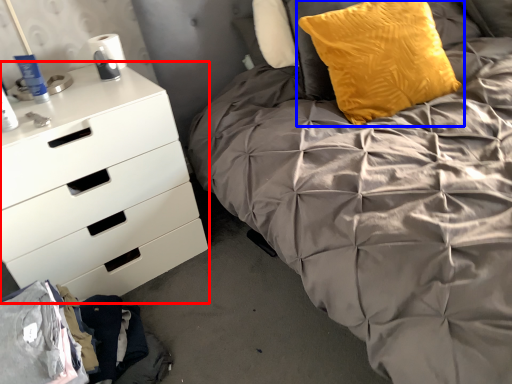
Question: Among these objects, which one is farthest to the camera, chest of drawers (highlighted by a red box) or pillow (highlighted by a blue box)?

Choices:
 (A) chest of drawers
 (B) pillow

Answer: (B)